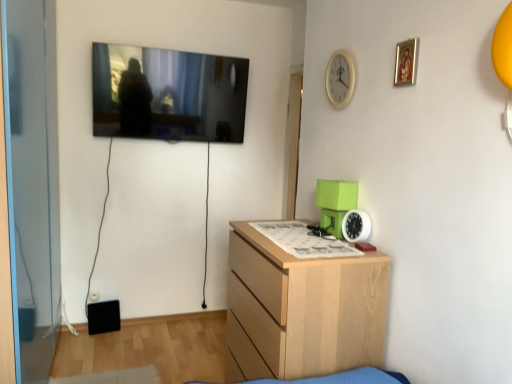
The image size is (512, 384). In order to click on unoccupied area in front of white plastic clock at right, the 1th clock from the bottom in this screenshot , I will do `click(351, 251)`.